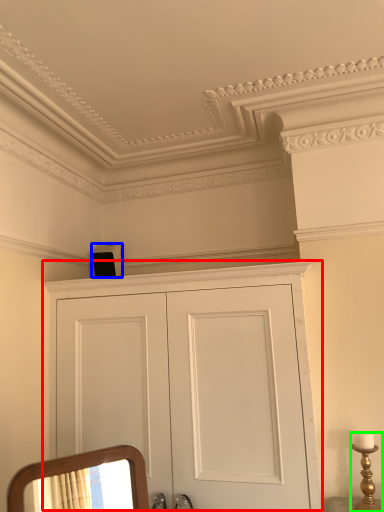
Question: Based on their relative distances, which object is farther from cupboard (highlighted by a red box)? Choose from speaker (highlighted by a blue box) and candle holder (highlighted by a green box).

Choices:
 (A) speaker
 (B) candle holder

Answer: (A)